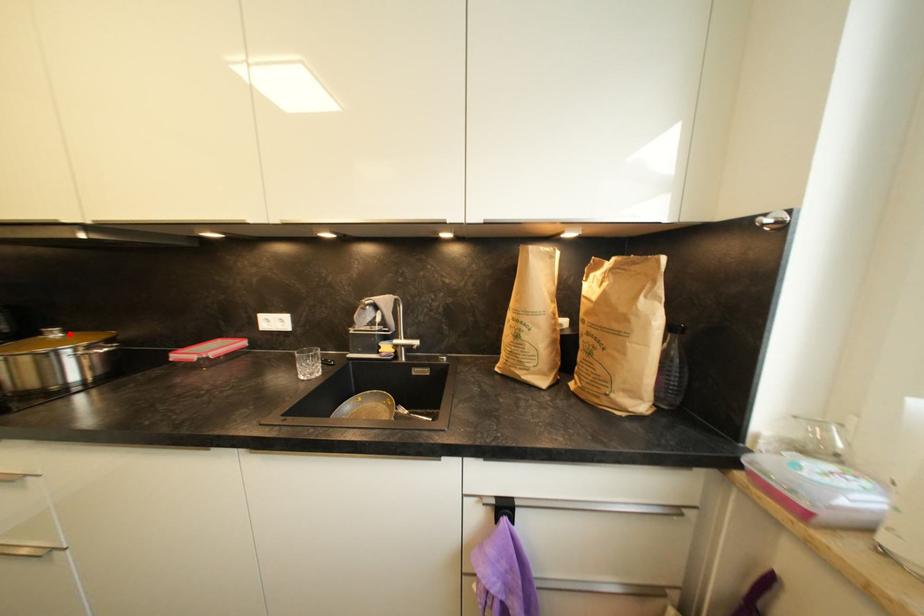
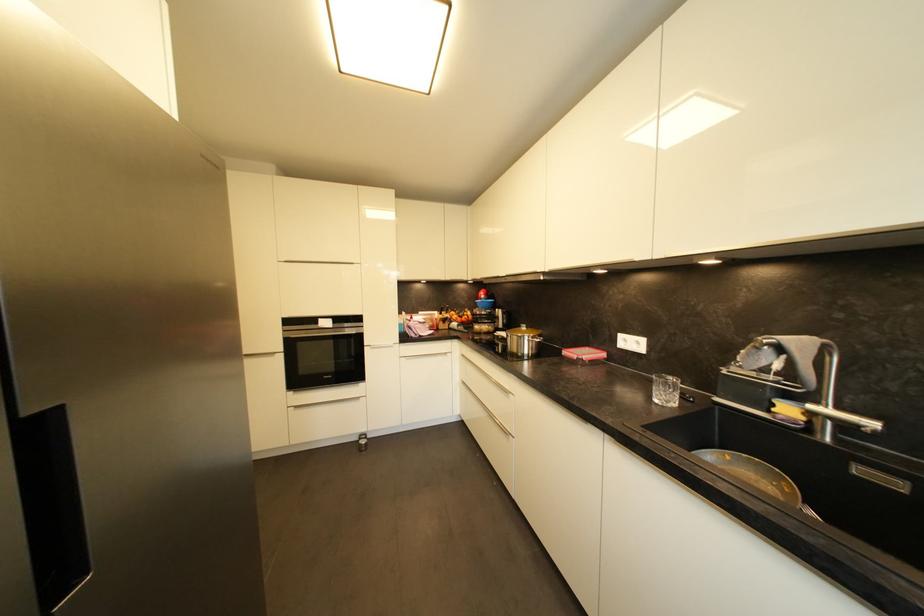
Question: I am providing you with two images of the same scene from different viewpoints. Given a red point in image1, look at the same physical point in image2. Is it:

Choices:
 (A) Closer to the viewpoint
 (B) Farther from the viewpoint

Answer: (B)